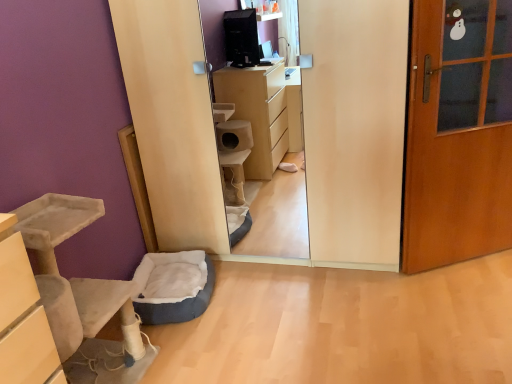
What is the approximate width of beige suede cat tree at lower left?

It is 41.57 centimeters.

Measure the distance between wooden door at right and camera.

wooden door at right is 6.22 feet away from camera.

Locate an element on the screen. blue fabric pet bed at lower left is located at coordinates (173, 286).

Can you see blue fabric pet bed at lower left touching wooden door at right?

No.

Is blue fabric pet bed at lower left situated inside wooden door at right or outside?

blue fabric pet bed at lower left is outside wooden door at right.

Is blue fabric pet bed at lower left smaller than wooden door at right?

Yes, blue fabric pet bed at lower left is smaller than wooden door at right.

From a real-world perspective, is blue fabric pet bed at lower left below wooden door at right?

Correct, in the physical world, blue fabric pet bed at lower left is lower than wooden door at right.

Looking at their sizes, would you say beige suede cat tree at lower left is wider or thinner than blue fabric pet bed at lower left?

beige suede cat tree at lower left is thinner than blue fabric pet bed at lower left.

Considering the positions of points (128, 354) and (163, 266), is point (128, 354) farther from camera compared to point (163, 266)?

No, it is in front of (163, 266).

How many degrees apart are the facing directions of beige suede cat tree at lower left and blue fabric pet bed at lower left?

There is a 13.1-degree angle between the facing directions of beige suede cat tree at lower left and blue fabric pet bed at lower left.

Are blue fabric pet bed at lower left and beige suede cat tree at lower left making contact?

There is a gap between blue fabric pet bed at lower left and beige suede cat tree at lower left.

Locate an element on the screen. This screenshot has width=512, height=384. infant bed behind the beige suede cat tree at lower left is located at coordinates (173, 286).

Is wooden door at right positioned behind blue fabric pet bed at lower left?

No.

Which of these two, wooden door at right or blue fabric pet bed at lower left, is smaller?

With smaller size is blue fabric pet bed at lower left.

From the image's perspective, which object appears higher, wooden door at right or blue fabric pet bed at lower left?

wooden door at right.

Considering the sizes of wooden door at right and blue fabric pet bed at lower left in the image, is wooden door at right taller or shorter than blue fabric pet bed at lower left?

Considering their sizes, wooden door at right has more height than blue fabric pet bed at lower left.

From a real-world perspective, who is located higher, wooden door at right or beige suede cat tree at lower left?

wooden door at right is physically above.

Is wooden door at right far away from beige suede cat tree at lower left?

Indeed, wooden door at right is not near beige suede cat tree at lower left.

Could you tell me if wooden door at right is turned towards beige suede cat tree at lower left?

No, wooden door at right is not turned towards beige suede cat tree at lower left.

Does wooden door at right lie in front of beige suede cat tree at lower left?

No, it is not.

Measure the distance between beige suede cat tree at lower left and wooden door at right.

They are 1.72 meters apart.

Which object is more forward, beige suede cat tree at lower left or wooden door at right?

Positioned in front is beige suede cat tree at lower left.

Is beige suede cat tree at lower left inside or outside of wooden door at right?

beige suede cat tree at lower left is not inside wooden door at right, it's outside.

Does beige suede cat tree at lower left have a larger size compared to wooden door at right?

Yes, beige suede cat tree at lower left is bigger than wooden door at right.

The image size is (512, 384). In order to click on infant bed directly beneath the wooden door at right (from a real-world perspective) in this screenshot , I will do `click(173, 286)`.

Locate an element on the screen. furniture located above the blue fabric pet bed at lower left (from a real-world perspective) is located at coordinates (82, 296).

From the image, which object appears to be nearer to wooden door at right, beige suede cat tree at lower left or blue fabric pet bed at lower left?

blue fabric pet bed at lower left lies closer to wooden door at right than the other object.

Estimate the real-world distances between objects in this image. Which object is closer to wooden door at right, blue fabric pet bed at lower left or beige suede cat tree at lower left?

blue fabric pet bed at lower left lies closer to wooden door at right than the other object.

From the image, which object appears to be nearer to beige suede cat tree at lower left, wooden door at right or blue fabric pet bed at lower left?

blue fabric pet bed at lower left.

Which object lies further to the anchor point blue fabric pet bed at lower left, beige suede cat tree at lower left or wooden door at right?

wooden door at right.

When comparing their distances from beige suede cat tree at lower left, does blue fabric pet bed at lower left or wooden door at right seem further?

Based on the image, wooden door at right appears to be further to beige suede cat tree at lower left.

Which object lies further to the anchor point blue fabric pet bed at lower left, wooden door at right or beige suede cat tree at lower left?

Among the two, wooden door at right is located further to blue fabric pet bed at lower left.

Identify the location of infant bed situated between beige suede cat tree at lower left and wooden door at right from left to right. (173, 286).